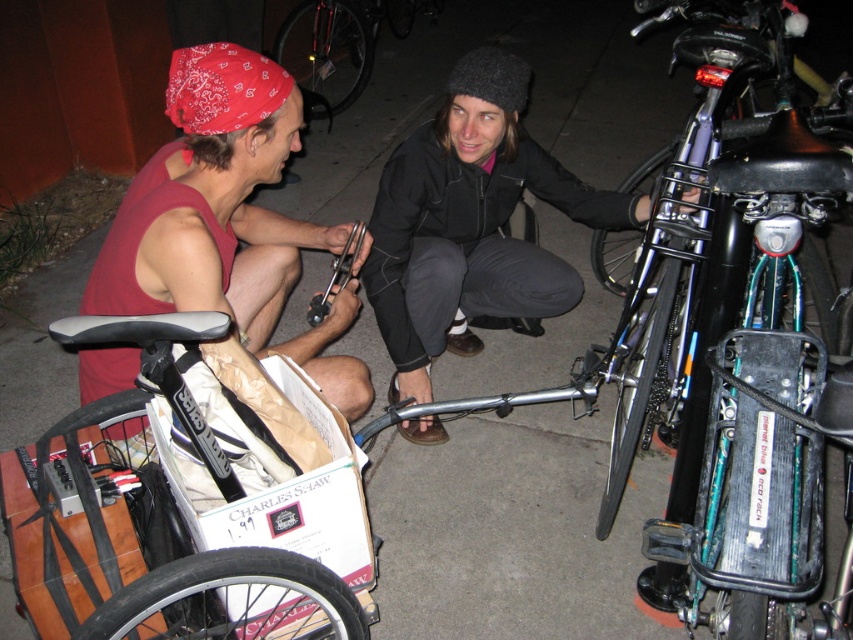
From the picture: You are standing in the scene and see a point at coordinates [74,342]. If you want to reach it without moving your feet, can you do it?

The point at coordinates [74,342] is 1.14 meters away from the viewer. Since this distance is within typical human arm reach, you can likely reach it without moving your feet.

From the picture: You are a delivery person who needs to attach a small package to the matte red bandana at left or the black matte bicycle at center. Which object can you attach the package to if the package requires a surface taller than the other object?

The black matte bicycle at center is taller than the matte red bandana at left, so you should attach the package to the black matte bicycle at center to ensure it has a surface taller than the matte red bandana at left.

You are a delivery person who needs to attach a small package to the matte red bandana at left or the black matte bicycle at center. Which object can you attach the package to without it being too large?

The matte red bandana at left is smaller than the black matte bicycle at center, so the package should be attached to the black matte bicycle at center to ensure it is not too large.